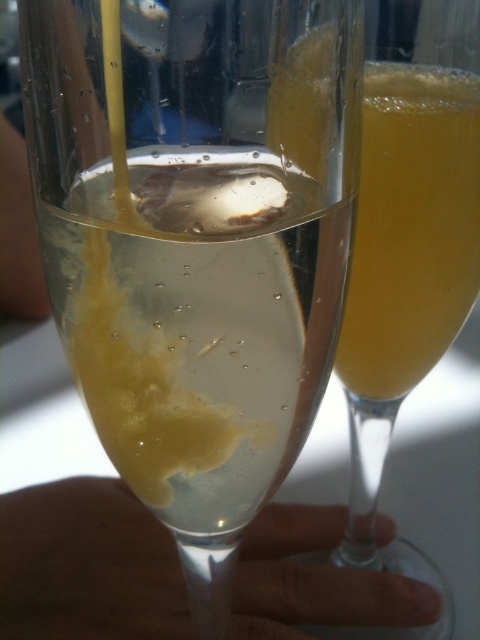
You are a bartender preparing drinks and need to place a garnish on the closest glass. Based on the image, which glass corresponds to the point that is closer to you, point at (180, 289) or point at (383, 627)?

Point at (180, 289) is in front of point at (383, 627), so the closest glass is the one corresponding to point at (180, 289).

You are a bartender preparing drinks and need to place a garnish on the clear glass at center. Since the translucent yellow liquid at center is already in the glass, where should you place the garnish relative to the liquid?

The clear glass at center is closer to the viewer than the translucent yellow liquid at center, so you should place the garnish above the translucent yellow liquid at center to ensure it rests on top of the glass.

You are at a brunch event and need to pour the translucent yellow liquid at center into the clear glass at center. Based on their sizes, will the liquid overflow when poured?

The clear glass at center is wider than the translucent yellow liquid at center, so pouring the liquid into it may not cause overflow as the glass can accommodate the liquid.